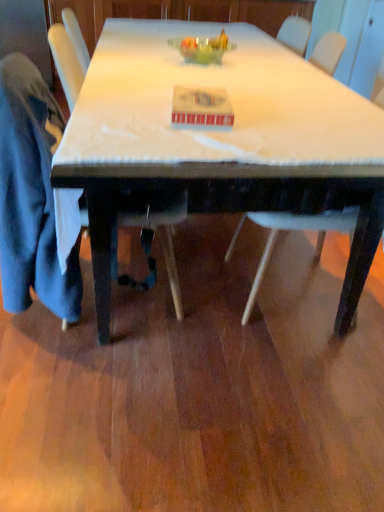
The image size is (384, 512). What do you see at coordinates (31, 195) in the screenshot? I see `velvet blue jacket at left, arranged as the first chair when viewed from the left` at bounding box center [31, 195].

Where is `velvet blue jacket at left, arranged as the first chair when viewed from the left`? The height and width of the screenshot is (512, 384). velvet blue jacket at left, arranged as the first chair when viewed from the left is located at coordinates pos(31,195).

In order to face white plastic chair at lower right, positioned as the 1th chair in right-to-left order, should I rotate leftwards or rightwards?

You should rotate right by 16.040 degrees.

The width and height of the screenshot is (384, 512). What are the coordinates of `white glossy table at center` in the screenshot? It's located at (223, 141).

Describe the element at coordinates (31, 195) in the screenshot. I see `blue cotton robe at left` at that location.

Locate an element on the screen. velvet blue jacket at left, arranged as the first chair when viewed from the left is located at coordinates (31, 195).

Would you say blue cotton robe at left is to the left or to the right of translucent glass bowl at center in the picture?

blue cotton robe at left is to the left of translucent glass bowl at center.

Considering the relative sizes of blue cotton robe at left and translucent glass bowl at center in the image provided, is blue cotton robe at left thinner than translucent glass bowl at center?

No.

The height and width of the screenshot is (512, 384). I want to click on food above the blue cotton robe at left (from a real-world perspective), so point(204,49).

Would you consider blue cotton robe at left to be distant from translucent glass bowl at center?

blue cotton robe at left is near translucent glass bowl at center, not far away.

Based on the photo, from a real-world perspective, is velvet blue jacket at left, the 2th chair from the right, under blue cotton robe at left?

Yes, from a real-world perspective, velvet blue jacket at left, the 2th chair from the right, is under blue cotton robe at left.

Which is more to the right, velvet blue jacket at left, the 2th chair from the right, or blue cotton robe at left?

Positioned to the right is velvet blue jacket at left, the 2th chair from the right.

Is velvet blue jacket at left, arranged as the first chair when viewed from the left, aimed at blue cotton robe at left?

Yes, velvet blue jacket at left, arranged as the first chair when viewed from the left, is facing blue cotton robe at left.

Is point (301, 228) positioned behind point (226, 44)?

No, (301, 228) is in front of (226, 44).

Is translucent glass bowl at center at the back of white plastic chair at lower right, arranged as the 2th chair when viewed from the left?

white plastic chair at lower right, arranged as the 2th chair when viewed from the left, is not turned away from translucent glass bowl at center.

From the image's perspective, between white plastic chair at lower right, arranged as the 2th chair when viewed from the left, and translucent glass bowl at center, who is located below?

white plastic chair at lower right, arranged as the 2th chair when viewed from the left, from the image's perspective.

Is velvet blue jacket at left, arranged as the first chair when viewed from the left, bigger or smaller than white plastic chair at lower right, positioned as the 1th chair in right-to-left order?

Clearly, velvet blue jacket at left, arranged as the first chair when viewed from the left, is larger in size than white plastic chair at lower right, positioned as the 1th chair in right-to-left order.

Locate an element on the screen. chair that appears on the left of white plastic chair at lower right, positioned as the 1th chair in right-to-left order is located at coordinates (31, 195).

Is velvet blue jacket at left, the 2th chair from the right, behind white plastic chair at lower right, arranged as the 2th chair when viewed from the left?

No, velvet blue jacket at left, the 2th chair from the right, is closer to the camera.

From a real-world perspective, is velvet blue jacket at left, the 2th chair from the right, physically below white plastic chair at lower right, positioned as the 1th chair in right-to-left order?

Correct, in the physical world, velvet blue jacket at left, the 2th chair from the right, is lower than white plastic chair at lower right, positioned as the 1th chair in right-to-left order.

How much distance is there between velvet blue jacket at left, the 2th chair from the right, and white glossy table at center?

A distance of 19.81 inches exists between velvet blue jacket at left, the 2th chair from the right, and white glossy table at center.

Is velvet blue jacket at left, the 2th chair from the right, positioned beyond the bounds of white glossy table at center?

That's correct, velvet blue jacket at left, the 2th chair from the right, is outside of white glossy table at center.

Who is smaller, velvet blue jacket at left, arranged as the first chair when viewed from the left, or white glossy table at center?

With smaller size is velvet blue jacket at left, arranged as the first chair when viewed from the left.

Can you confirm if velvet blue jacket at left, the 2th chair from the right, is wider than white glossy table at center?

No.

From a real-world perspective, which chair is the 1st one underneath the white glossy table at center? Please provide its 2D coordinates.

[(287, 230)]

Considering the positions of objects white glossy table at center and white plastic chair at lower right, positioned as the 1th chair in right-to-left order, in the image provided, who is more to the right, white glossy table at center or white plastic chair at lower right, positioned as the 1th chair in right-to-left order,?

From the viewer's perspective, white plastic chair at lower right, positioned as the 1th chair in right-to-left order, appears more on the right side.

Considering the relative sizes of white glossy table at center and white plastic chair at lower right, arranged as the 2th chair when viewed from the left, in the image provided, is white glossy table at center bigger than white plastic chair at lower right, arranged as the 2th chair when viewed from the left,?

Indeed, white glossy table at center has a larger size compared to white plastic chair at lower right, arranged as the 2th chair when viewed from the left.

Is the position of white glossy table at center more distant than that of white plastic chair at lower right, positioned as the 1th chair in right-to-left order?

No, the depth of white glossy table at center is less than that of white plastic chair at lower right, positioned as the 1th chair in right-to-left order.

Looking at this image, is velvet blue jacket at left, arranged as the first chair when viewed from the left, located within translucent glass bowl at center?

No.

Is translucent glass bowl at center wider or thinner than velvet blue jacket at left, arranged as the first chair when viewed from the left?

Considering their sizes, translucent glass bowl at center looks slimmer than velvet blue jacket at left, arranged as the first chair when viewed from the left.

I want to click on the 2nd chair below the translucent glass bowl at center (from a real-world perspective), so click(x=31, y=195).

From the image's perspective, between translucent glass bowl at center and velvet blue jacket at left, arranged as the first chair when viewed from the left, who is located below?

velvet blue jacket at left, arranged as the first chair when viewed from the left, appears lower in the image.

Locate an element on the screen. The width and height of the screenshot is (384, 512). food located on the right of blue cotton robe at left is located at coordinates (204, 49).

Find the location of a particular element. Image resolution: width=384 pixels, height=512 pixels. robe above the velvet blue jacket at left, arranged as the first chair when viewed from the left (from a real-world perspective) is located at coordinates (31, 195).

Estimate the real-world distances between objects in this image. Which object is closer to blue cotton robe at left, velvet blue jacket at left, the 2th chair from the right, or white glossy table at center?

velvet blue jacket at left, the 2th chair from the right.

When comparing their distances from blue cotton robe at left, does white plastic chair at lower right, arranged as the 2th chair when viewed from the left, or velvet blue jacket at left, arranged as the first chair when viewed from the left, seem closer?

velvet blue jacket at left, arranged as the first chair when viewed from the left.

Consider the image. Considering their positions, is translucent glass bowl at center positioned further to blue cotton robe at left than velvet blue jacket at left, arranged as the first chair when viewed from the left?

translucent glass bowl at center is positioned further to the anchor blue cotton robe at left.

Based on their spatial positions, is white glossy table at center or translucent glass bowl at center closer to white plastic chair at lower right, arranged as the 2th chair when viewed from the left?

Among the two, white glossy table at center is located nearer to white plastic chair at lower right, arranged as the 2th chair when viewed from the left.

Looking at the image, which one is located further to white glossy table at center, velvet blue jacket at left, the 2th chair from the right, or translucent glass bowl at center?

Based on the image, translucent glass bowl at center appears to be further to white glossy table at center.

Which object lies further to the anchor point white glossy table at center, translucent glass bowl at center or blue cotton robe at left?

translucent glass bowl at center is positioned further to the anchor white glossy table at center.

From the image, which object appears to be farther from blue cotton robe at left, white plastic chair at lower right, arranged as the 2th chair when viewed from the left, or white glossy table at center?

Among the two, white plastic chair at lower right, arranged as the 2th chair when viewed from the left, is located further to blue cotton robe at left.

Which object lies further to the anchor point white glossy table at center, blue cotton robe at left or translucent glass bowl at center?

translucent glass bowl at center lies further to white glossy table at center than the other object.

Where is `desk between velvet blue jacket at left, arranged as the first chair when viewed from the left, and white plastic chair at lower right, positioned as the 1th chair in right-to-left order`? The height and width of the screenshot is (512, 384). desk between velvet blue jacket at left, arranged as the first chair when viewed from the left, and white plastic chair at lower right, positioned as the 1th chair in right-to-left order is located at coordinates (223, 141).

This screenshot has height=512, width=384. I want to click on chair between blue cotton robe at left and white glossy table at center in the horizontal direction, so click(31, 195).

This screenshot has width=384, height=512. Identify the location of chair between blue cotton robe at left and white plastic chair at lower right, arranged as the 2th chair when viewed from the left, from left to right. (31, 195).

You are a GUI agent. You are given a task and a screenshot of the screen. Output one action in this format:
    pyautogui.click(x=<x>, y=<y>)
    Task: Click on the robe located between white glossy table at center and translucent glass bowl at center in the depth direction
    This screenshot has width=384, height=512.
    Given the screenshot: What is the action you would take?
    pyautogui.click(x=31, y=195)